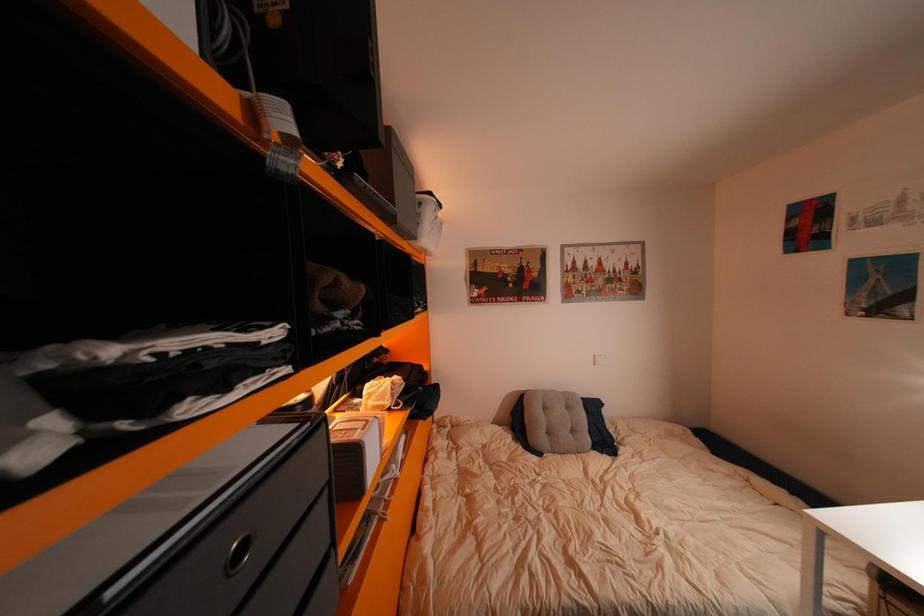
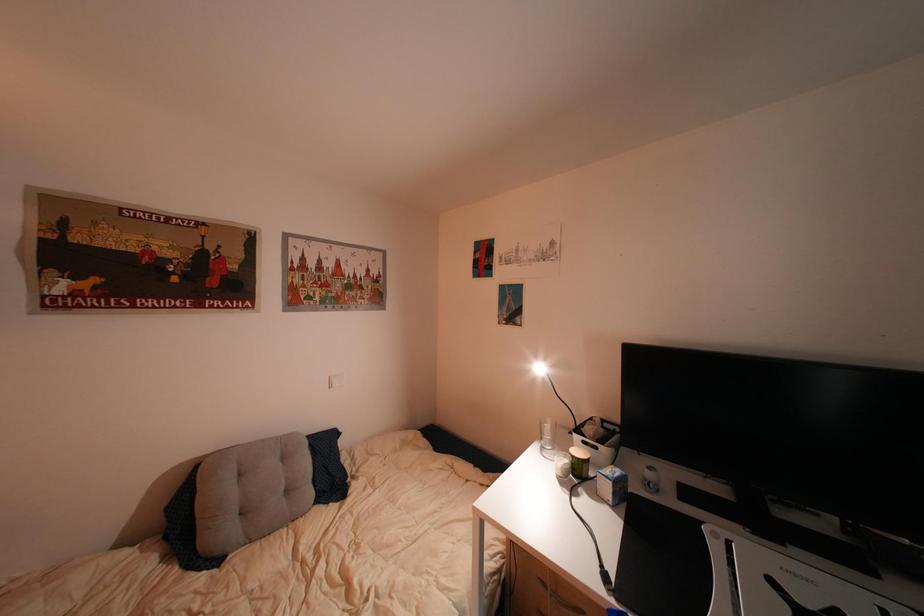
Question: The camera is either moving clockwise (left) or counter-clockwise (right) around the object. The first image is from the beginning of the video and the second image is from the end. Is the camera moving left or right when shooting the video?

Choices:
 (A) Left
 (B) Right

Answer: (A)